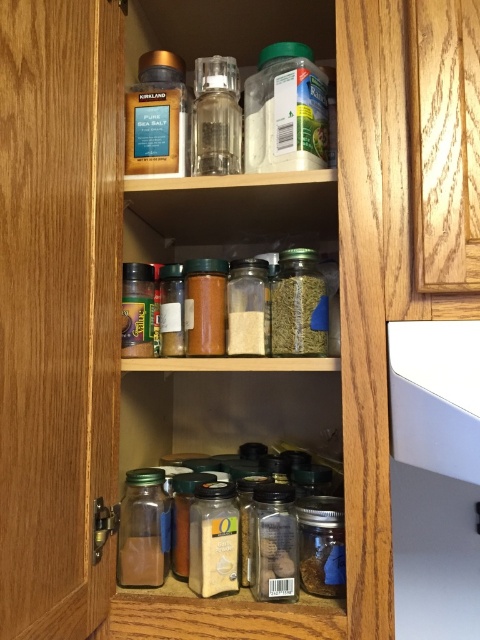
Does transparent glass grinder at center appear on the left side of green matte glass jar at center?

Correct, you'll find transparent glass grinder at center to the left of green matte glass jar at center.

Which is above, transparent glass grinder at center or green matte glass jar at center?

transparent glass grinder at center is higher up.

Locate an element on the screen. transparent glass grinder at center is located at coordinates (216, 116).

Can you confirm if translucent glass jar at center is wider than transparent glass jar at center?

Yes, translucent glass jar at center is wider than transparent glass jar at center.

Who is positioned more to the left, translucent glass jar at center or transparent glass jar at center?

translucent glass jar at center is more to the left.

Does point (200, 484) lie in front of point (292, 564)?

That is False.

Find the location of a particular element. The width and height of the screenshot is (480, 640). translucent glass jar at center is located at coordinates (214, 540).

Which of these two, translucent glass jar at center or translucent glass spice jar at center, stands shorter?

translucent glass jar at center

Image resolution: width=480 pixels, height=640 pixels. What are the coordinates of `translucent glass jar at center` in the screenshot? It's located at (214, 540).